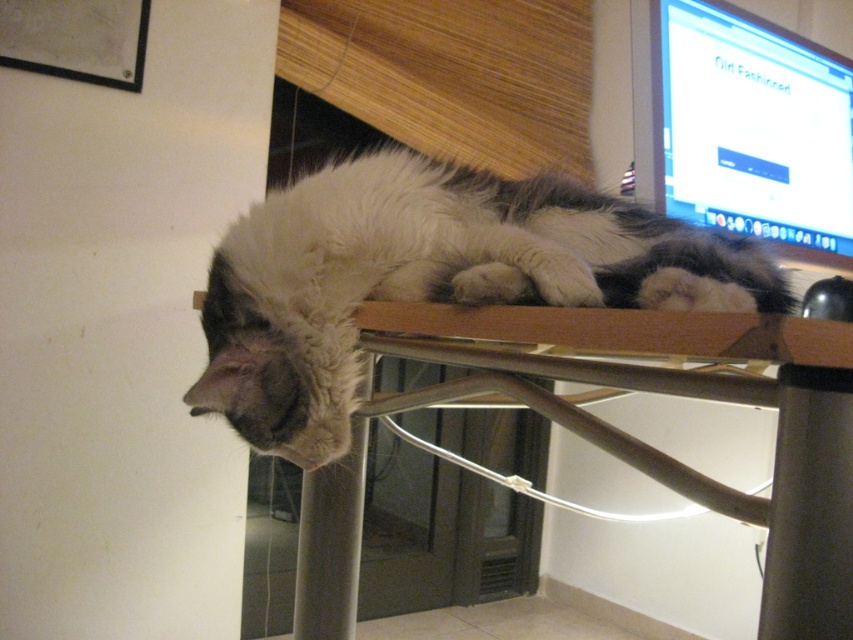
Looking at this image, you need to place a new keyboard on the desk next to the matte plastic monitor at upper right without disturbing the white fluffy cat at center. Is there enough space between them?

The white fluffy cat at center is wider than the matte plastic monitor at upper right. Since the cat is occupying more space, there might not be enough room to place the keyboard next to the monitor without moving the cat.

What are the coordinates of the white fluffy cat at center?

The white fluffy cat at center is located at point (428, 278).